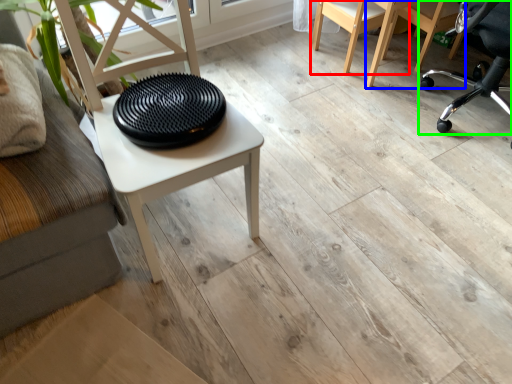
Question: Considering the real-world distances, which object is closest to chair (highlighted by a red box)? chair (highlighted by a blue box) or chair (highlighted by a green box).

Choices:
 (A) chair
 (B) chair

Answer: (A)